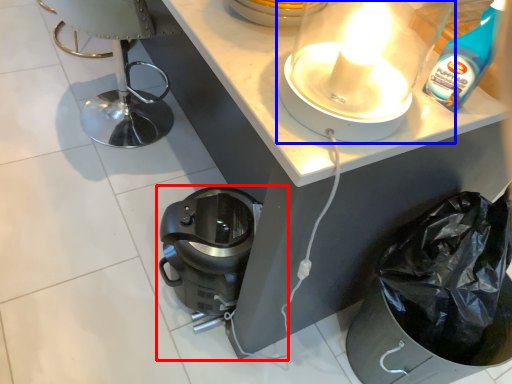
Question: Which object appears closest to the camera in this image, home appliance (highlighted by a red box) or kitchen appliance (highlighted by a blue box)?

Choices:
 (A) home appliance
 (B) kitchen appliance

Answer: (B)